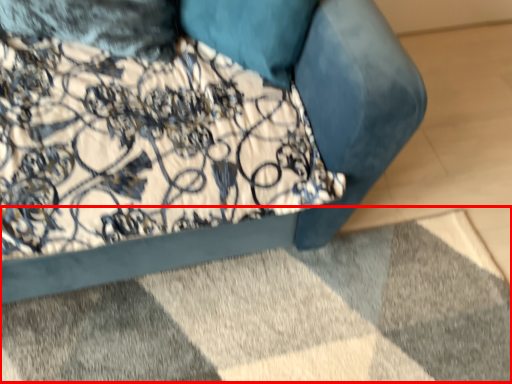
Question: Where is mat (annotated by the red box) located in relation to furniture in the image?

Choices:
 (A) right
 (B) left

Answer: (A)